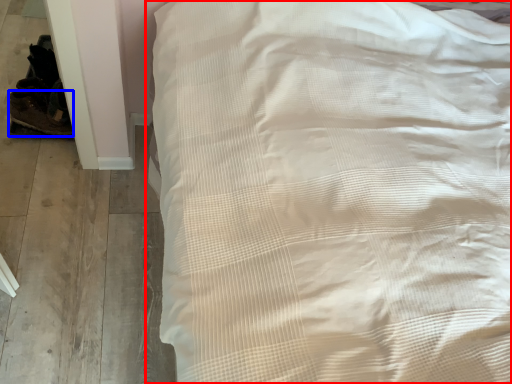
Question: Among these objects, which one is farthest to the camera, bed (highlighted by a red box) or shoe (highlighted by a blue box)?

Choices:
 (A) bed
 (B) shoe

Answer: (B)